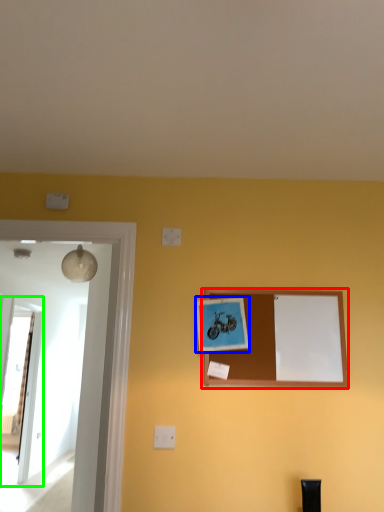
Question: Considering the real-world distances, which object is closest to picture frame (highlighted by a red box)? picture frame (highlighted by a blue box) or glass door (highlighted by a green box).

Choices:
 (A) picture frame
 (B) glass door

Answer: (A)